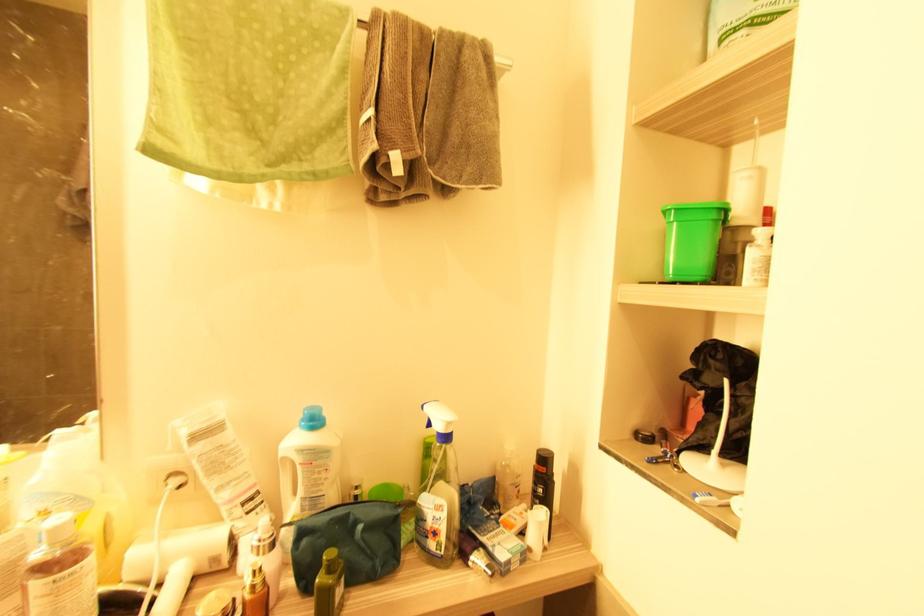
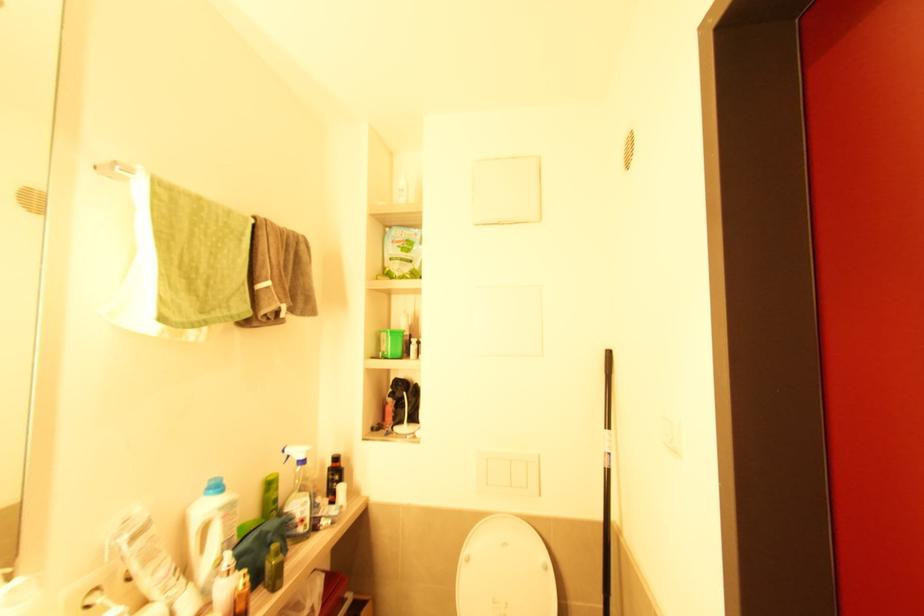
Locate, in the second image, the point that corresponds to point 301,464 in the first image.

(224, 519)